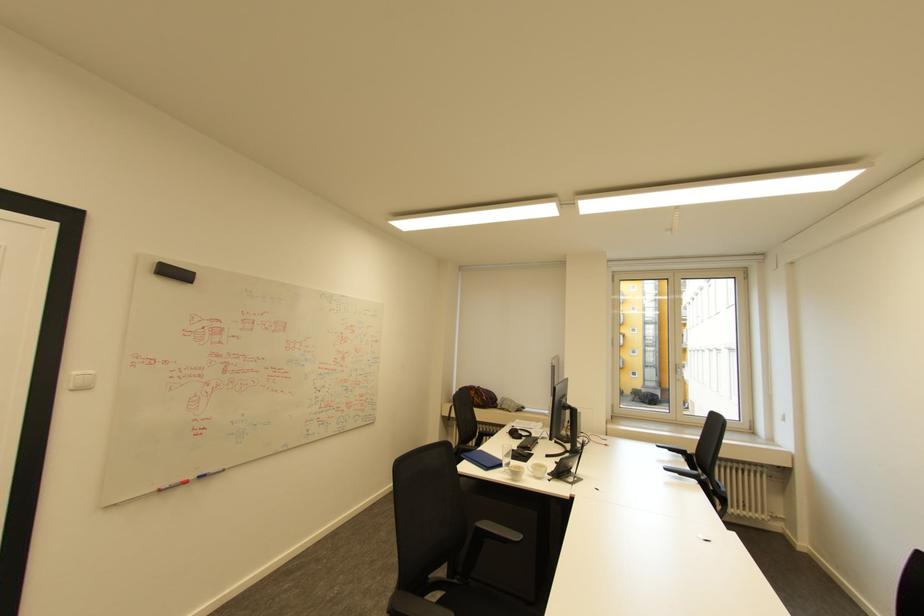
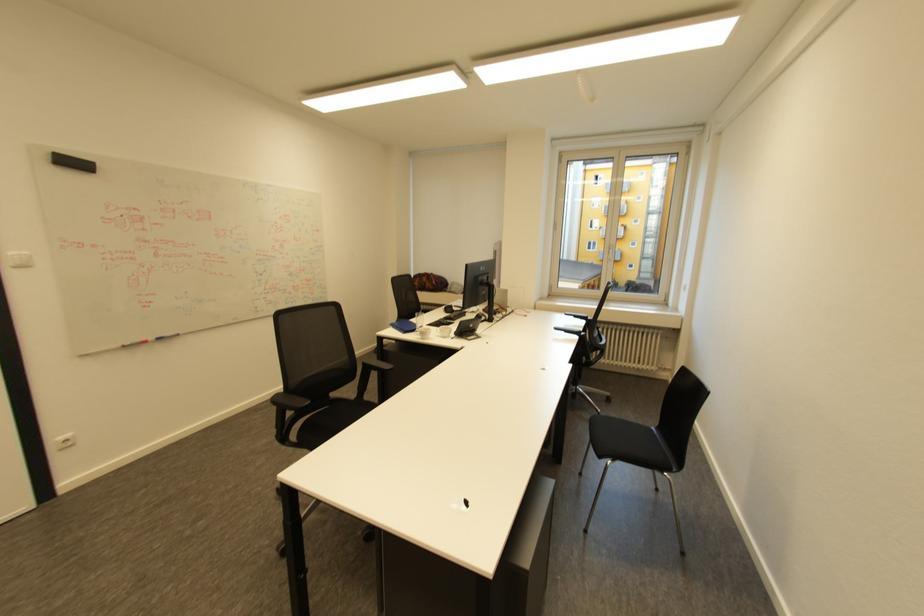
Question: The images are taken continuously from a first-person perspective. In which direction is your viewpoint rotating?

Choices:
 (A) Left
 (B) Right
 (C) Up
 (D) Down

Answer: (D)